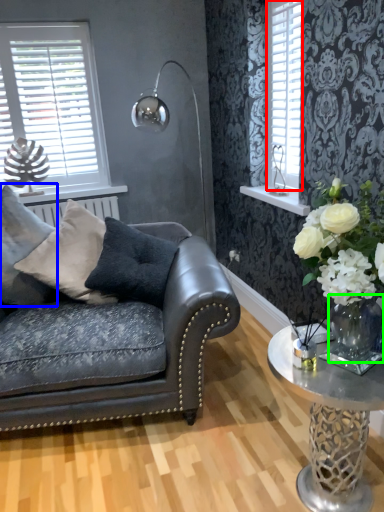
Question: Estimate the real-world distances between objects in this image. Which object is closer to shutter (highlighted by a red box), pillow (highlighted by a blue box) or vase (highlighted by a green box)?

Choices:
 (A) pillow
 (B) vase

Answer: (B)